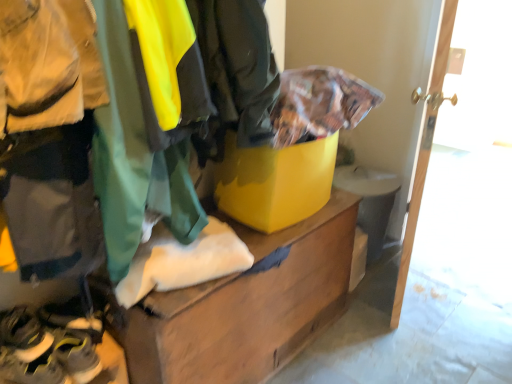
Question: Considering their positions, is yellow rubber shoes at lower left, which is the first footwear from top to bottom, located in front of or behind yellow matte cardboard box at center?

Choices:
 (A) behind
 (B) front

Answer: (B)

Question: Looking at the image, does yellow rubber shoes at lower left, which is the first footwear from top to bottom, seem bigger or smaller compared to yellow matte cardboard box at center?

Choices:
 (A) big
 (B) small

Answer: (B)

Question: Which of these objects is positioned farthest from the wooden chest at center?

Choices:
 (A) yellow mesh sneakers at lower left, the second footwear positioned from the top
 (B) yellow matte cardboard box at center
 (C) wooden door at right
 (D) yellow rubber shoes at lower left, which is the first footwear from top to bottom

Answer: (D)

Question: Based on their relative distances, which object is nearer to the wooden door at right?

Choices:
 (A) wooden chest at center
 (B) yellow mesh sneakers at lower left, the second footwear positioned from the top
 (C) yellow matte cardboard box at center
 (D) yellow rubber shoes at lower left, which is the first footwear from top to bottom

Answer: (C)